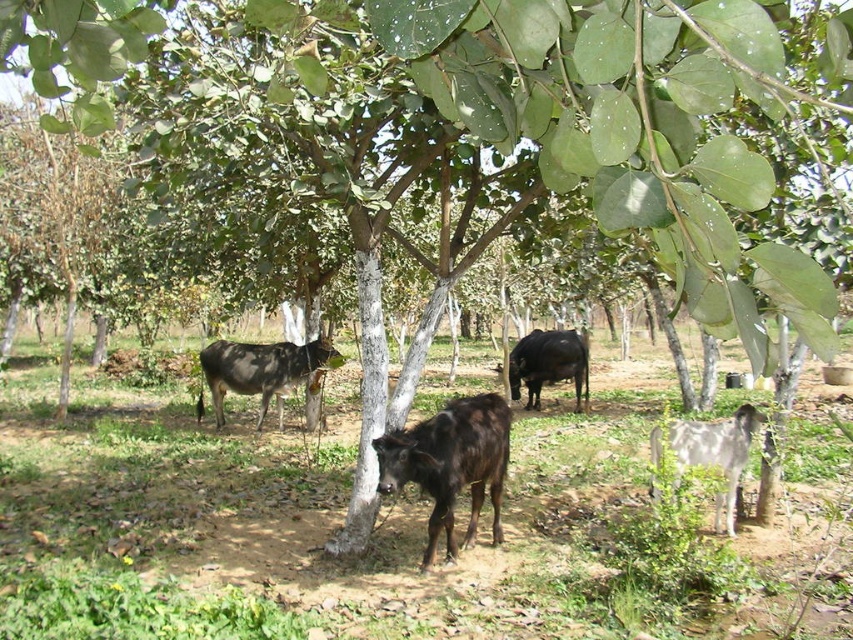
Consider the image. Does shiny black cow at center appear on the left side of white woolly goat at lower right?

Correct, you'll find shiny black cow at center to the left of white woolly goat at lower right.

Which is more to the left, shiny black cow at center or white woolly goat at lower right?

From the viewer's perspective, shiny black cow at center appears more on the left side.

Is point (460, 484) closer to camera compared to point (726, 429)?

Yes, it is in front of point (726, 429).

Find the location of a particular element. The image size is (853, 640). shiny black cow at center is located at coordinates (450, 464).

Which is in front, point (628, 609) or point (334, 364)?

Point (628, 609) is more forward.

Is green grass at center bigger than dark brown glossy cow at center?

Yes, green grass at center is bigger than dark brown glossy cow at center.

Is point (103, 480) positioned after point (312, 340)?

No, it is not.

Identify the location of green grass at center. (395, 525).

Can you confirm if dark brown glossy cow at center is wider than white woolly goat at lower right?

Indeed, dark brown glossy cow at center has a greater width compared to white woolly goat at lower right.

Which is in front, point (280, 404) or point (744, 465)?

Point (744, 465) is more forward.

Which is behind, point (262, 380) or point (720, 452)?

Point (262, 380)

At what (x,y) coordinates should I click in order to perform the action: click on dark brown glossy cow at center. Please return your answer as a coordinate pair (x, y). The width and height of the screenshot is (853, 640). Looking at the image, I should click on (260, 371).